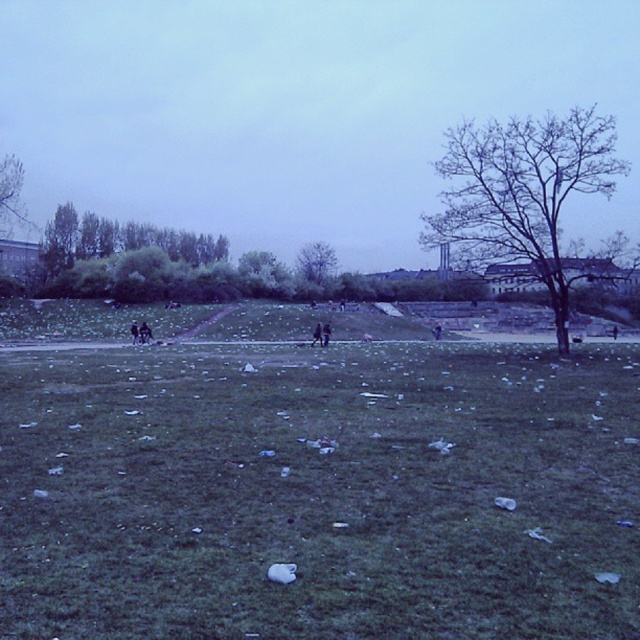
You are standing at the point marked by the coordinate point at (321, 493) in the image. What is the color of the ground beneath your feet?

The point at (321, 493) marks green grass at center, so the ground beneath your feet is green grass.

You are a gardener planning to mow the green grass at center and trim the bare branches at upper right. Based on their positions, which task should you tackle first if you start from the left side of the field?

The green grass at center is to the left of the bare branches at upper right, so you should mow the green grass at center first before trimming the bare branches at upper right since it is positioned to the left.

You are standing in the open grassy field and want to walk towards the two points marked in the scene. Which point, point (x=13, y=200) or point (x=296, y=260), will you reach first?

You will reach point (x=13, y=200) first because it is closer to you than point (x=296, y=260).